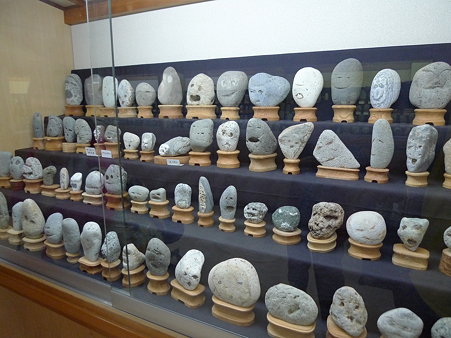
I want to click on wall, so click(279, 25), click(34, 49).